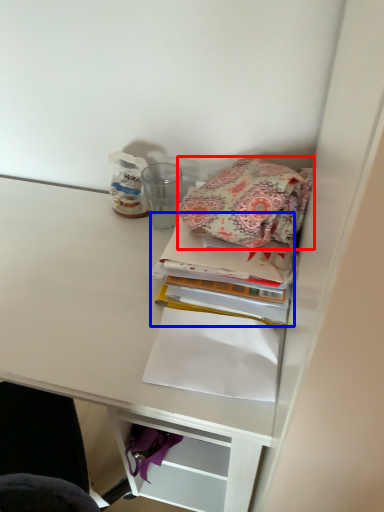
Question: Which point is closer to the camera, cloth (highlighted by a red box) or book (highlighted by a blue box)?

Choices:
 (A) cloth
 (B) book

Answer: (A)